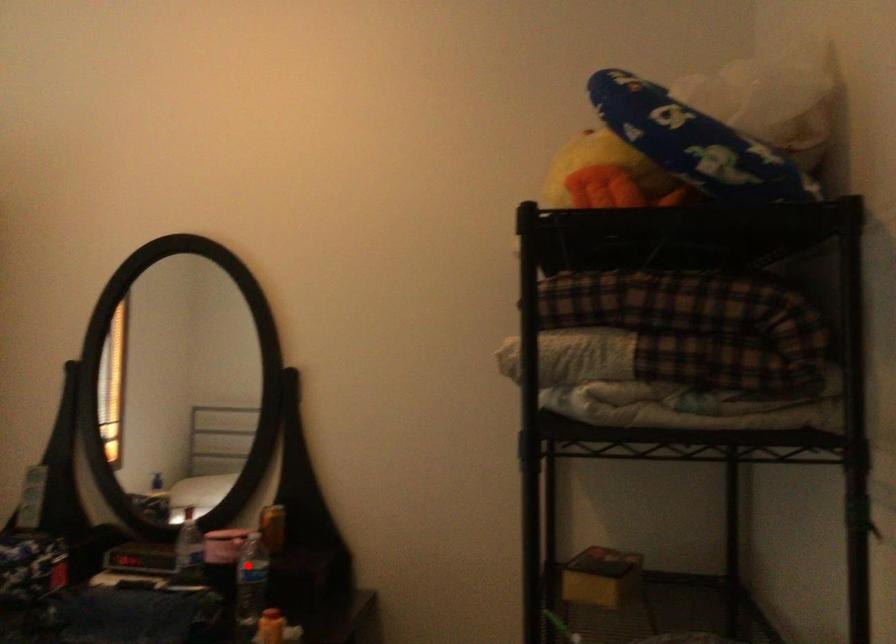
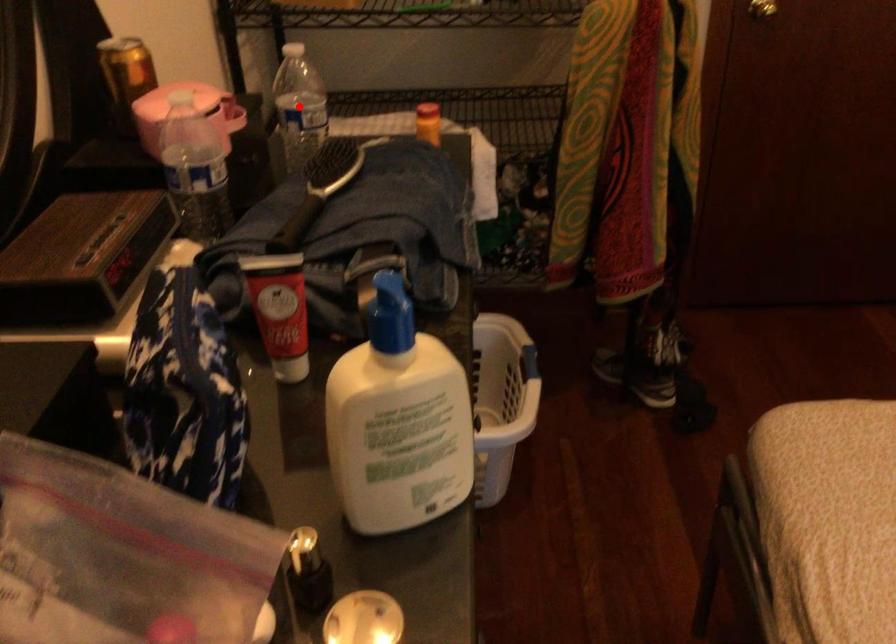
I am providing you with two images of the same scene from different viewpoints. A red point is marked on the first image and another point is marked on the second image. Do the highlighted points in image1 and image2 indicate the same real-world spot?

Yes